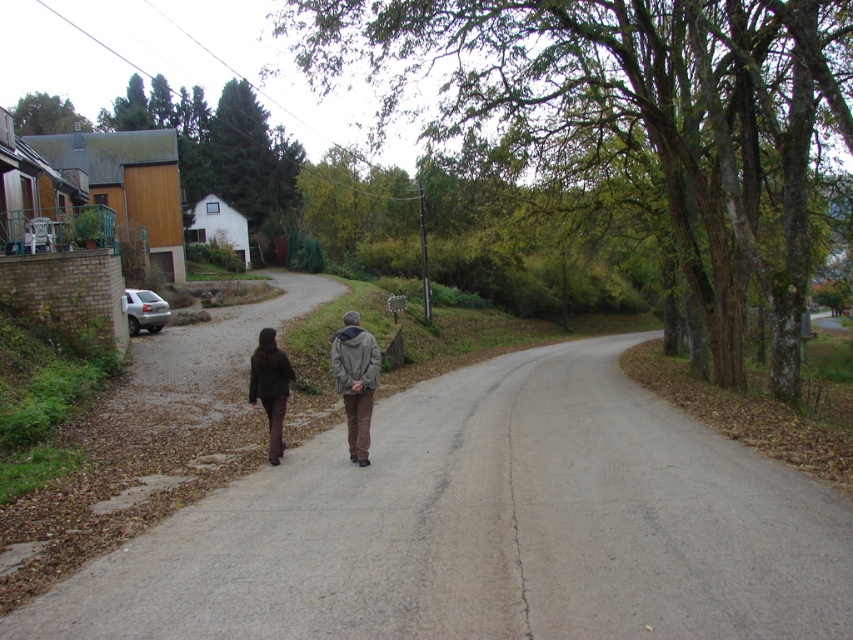
Question: Among these objects, which one is nearest to the camera?

Choices:
 (A) gray woolen jacket at center
 (B) brown leather jacket at center

Answer: (A)

Question: Is gray asphalt road at center bigger than brown leather jacket at center?

Choices:
 (A) yes
 (B) no

Answer: (B)

Question: Observing the image, what is the correct spatial positioning of brown leather jacket at center in reference to gray woolen jacket at center?

Choices:
 (A) right
 (B) left

Answer: (B)

Question: Observing the image, what is the correct spatial positioning of gray asphalt road at center in reference to gray woolen jacket at center?

Choices:
 (A) left
 (B) right

Answer: (B)

Question: Based on their relative distances, which object is nearer to the gray woolen jacket at center?

Choices:
 (A) brown leather jacket at center
 (B) dark brown leather jacket at center
 (C) gray asphalt road at center

Answer: (A)

Question: Which is nearer to the brown leather jacket at center?

Choices:
 (A) gray woolen jacket at center
 (B) gray asphalt road at center
 (C) dark brown leather jacket at center

Answer: (A)